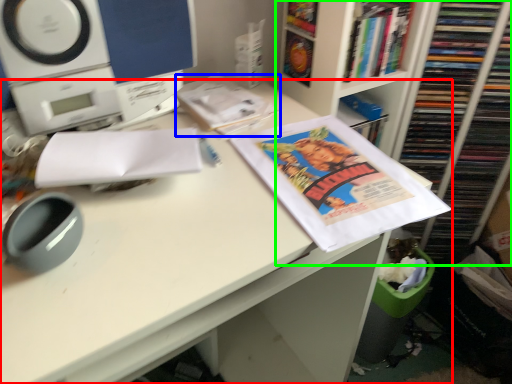
Question: Which object is the farthest from desk (highlighted by a red box)? Choose among these: book (highlighted by a blue box) or bookcase (highlighted by a green box).

Choices:
 (A) book
 (B) bookcase

Answer: (B)